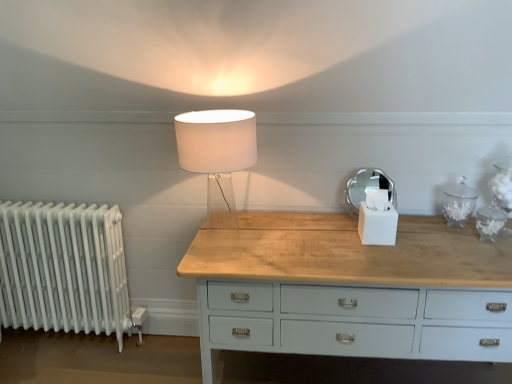
Find the location of a particular element. unoccupied area in front of white metallic radiator at left is located at coordinates (64, 363).